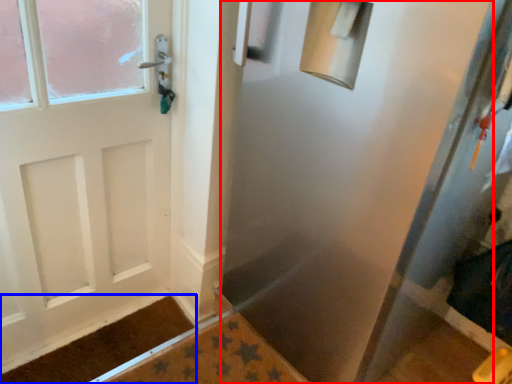
Question: Which object is closer to the camera taking this photo, screen door (highlighted by a red box) or doormat (highlighted by a blue box)?

Choices:
 (A) screen door
 (B) doormat

Answer: (A)